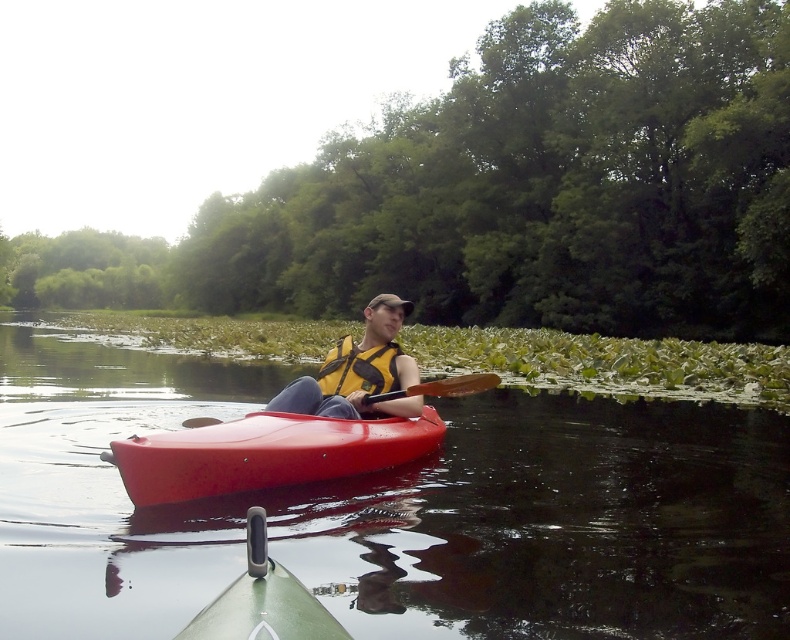
Locate an element on the screen. The height and width of the screenshot is (640, 790). yellow life vest at center is located at coordinates (358, 371).

Image resolution: width=790 pixels, height=640 pixels. What do you see at coordinates (358, 371) in the screenshot?
I see `yellow life vest at center` at bounding box center [358, 371].

Is point (405, 372) positioned behind point (371, 381)?

Yes.

Image resolution: width=790 pixels, height=640 pixels. I want to click on yellow life vest at center, so [x=358, y=371].

Who is positioned more to the left, matte red canoe at center or yellow life vest at center?

matte red canoe at center is more to the left.

Is point (344, 420) closer to viewer compared to point (405, 410)?

Yes, it is in front of point (405, 410).

Image resolution: width=790 pixels, height=640 pixels. What are the coordinates of `matte red canoe at center` in the screenshot? It's located at [x=265, y=452].

Is matte red canoe at center closer to the viewer compared to yellow fabric life jacket at center?

Yes, matte red canoe at center is closer to the viewer.

You are a GUI agent. You are given a task and a screenshot of the screen. Output one action in this format:
    pyautogui.click(x=<x>, y=<y>)
    Task: Click on the matte red canoe at center
    Image resolution: width=790 pixels, height=640 pixels.
    Given the screenshot: What is the action you would take?
    pyautogui.click(x=265, y=452)